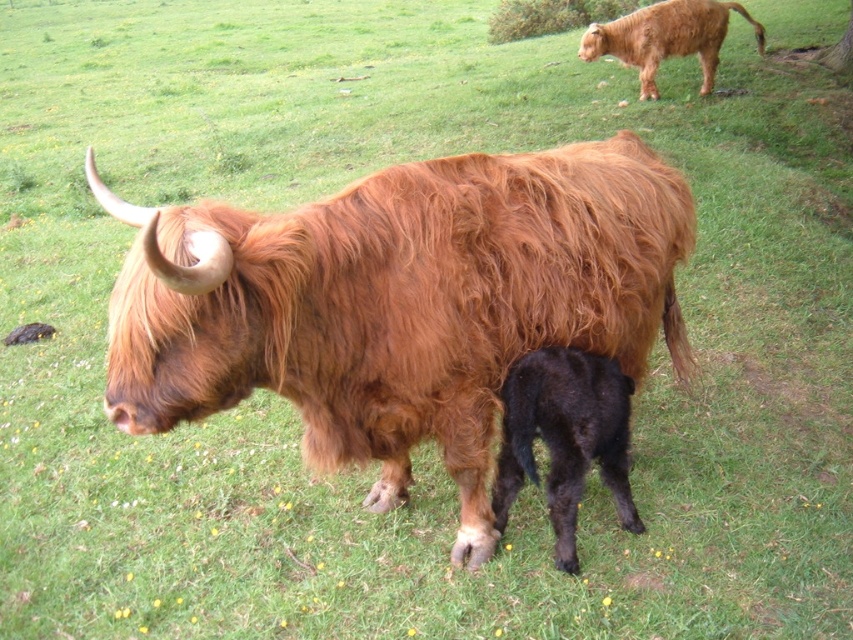
Question: Based on their relative distances, which object is farther from the black fuzzy calf at lower center?

Choices:
 (A) brown shaggy yak at upper right
 (B) shaggy brown yak at center

Answer: (A)

Question: Which object is closer to the camera taking this photo?

Choices:
 (A) brown shaggy yak at upper right
 (B) black fuzzy calf at lower center

Answer: (B)

Question: In this image, where is shaggy brown yak at center located relative to black fuzzy calf at lower center?

Choices:
 (A) left
 (B) right

Answer: (A)

Question: Is shaggy brown yak at center smaller than brown shaggy yak at upper right?

Choices:
 (A) yes
 (B) no

Answer: (B)

Question: Which point is farther from the camera taking this photo?

Choices:
 (A) (219, 333)
 (B) (583, 358)
 (C) (672, 51)

Answer: (C)

Question: Is black fuzzy calf at lower center to the right of brown shaggy yak at upper right from the viewer's perspective?

Choices:
 (A) no
 (B) yes

Answer: (A)